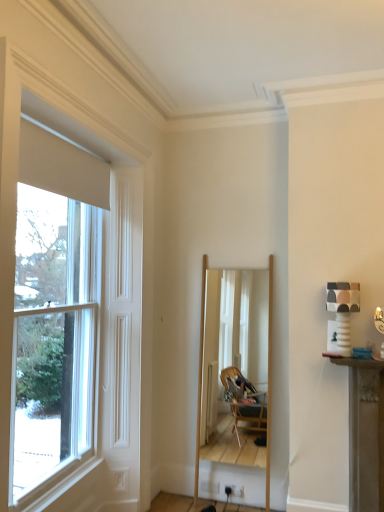
Question: Considering the relative sizes of white glossy window at left and wooden mirror at center in the image provided, is white glossy window at left taller than wooden mirror at center?

Choices:
 (A) yes
 (B) no

Answer: (A)

Question: Does white glossy window at left lie behind wooden mirror at center?

Choices:
 (A) yes
 (B) no

Answer: (B)

Question: From a real-world perspective, is white glossy window at left below wooden mirror at center?

Choices:
 (A) no
 (B) yes

Answer: (A)

Question: Is white glossy window at left thinner than wooden mirror at center?

Choices:
 (A) yes
 (B) no

Answer: (A)

Question: Considering the relative sizes of white glossy window at left and wooden mirror at center in the image provided, is white glossy window at left smaller than wooden mirror at center?

Choices:
 (A) no
 (B) yes

Answer: (A)

Question: From the image's perspective, does white glossy window at left appear lower than wooden mirror at center?

Choices:
 (A) yes
 (B) no

Answer: (B)

Question: Is wooden mirror at center next to white glossy window at left?

Choices:
 (A) yes
 (B) no

Answer: (B)

Question: Are wooden mirror at center and white glossy window at left far apart?

Choices:
 (A) no
 (B) yes

Answer: (B)

Question: From a real-world perspective, does wooden mirror at center stand above white glossy window at left?

Choices:
 (A) yes
 (B) no

Answer: (B)

Question: From the image's perspective, would you say wooden mirror at center is positioned over white glossy window at left?

Choices:
 (A) yes
 (B) no

Answer: (B)

Question: Is wooden mirror at center wider than white glossy window at left?

Choices:
 (A) yes
 (B) no

Answer: (A)

Question: Is wooden mirror at center in front of white glossy window at left?

Choices:
 (A) no
 (B) yes

Answer: (A)

Question: In terms of size, does wooden mirror at center appear bigger or smaller than white glossy window at left?

Choices:
 (A) small
 (B) big

Answer: (A)